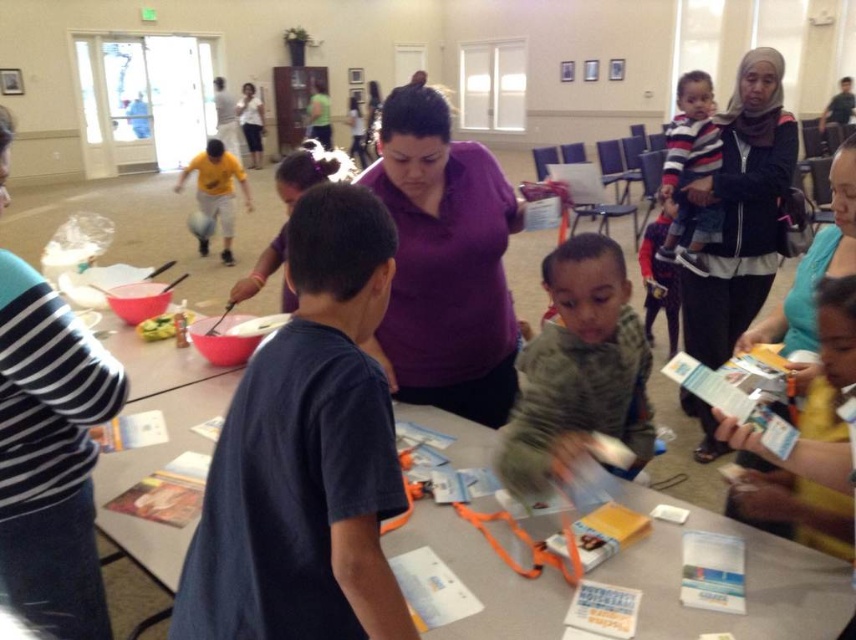
Question: Which point is farther to the camera?

Choices:
 (A) (728, 122)
 (B) (396, 317)

Answer: (A)

Question: Is gray knit sweater at center closer to camera compared to yellow cotton shirt at upper left?

Choices:
 (A) yes
 (B) no

Answer: (A)

Question: Estimate the real-world distances between objects in this image. Which object is farther from the dark blue t-shirt at center?

Choices:
 (A) gray knit sweater at center
 (B) black matte jacket at upper right
 (C) white paper table at center

Answer: (B)

Question: Is gray knit sweater at center bigger than yellow cotton shirt at upper left?

Choices:
 (A) no
 (B) yes

Answer: (A)

Question: Based on their relative distances, which object is nearer to the yellow cotton shirt at upper left?

Choices:
 (A) striped cotton shirt at upper right
 (B) black matte jacket at upper right
 (C) dark blue t-shirt at center
 (D) gray knit sweater at center

Answer: (A)

Question: Is dark blue t-shirt at center positioned behind yellow cotton shirt at upper left?

Choices:
 (A) yes
 (B) no

Answer: (B)